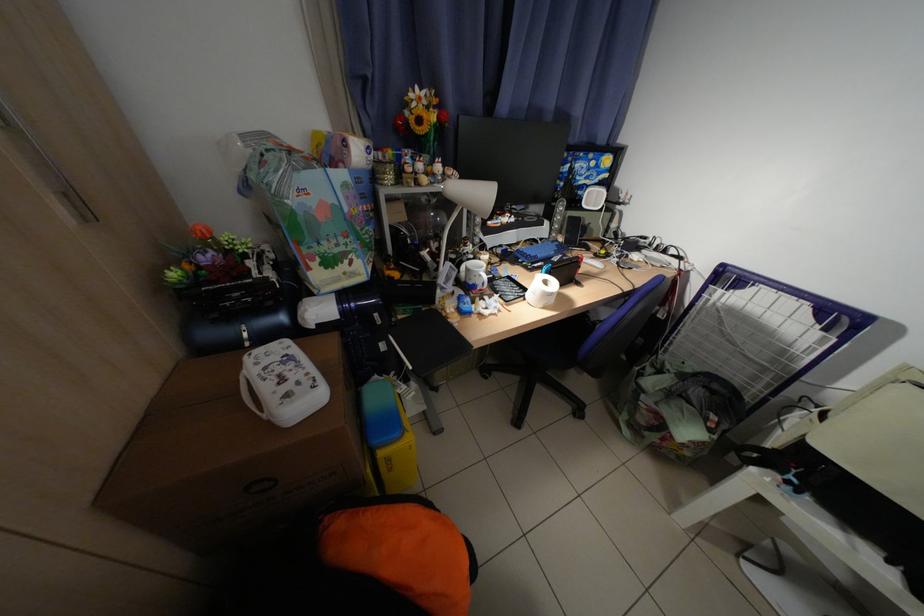
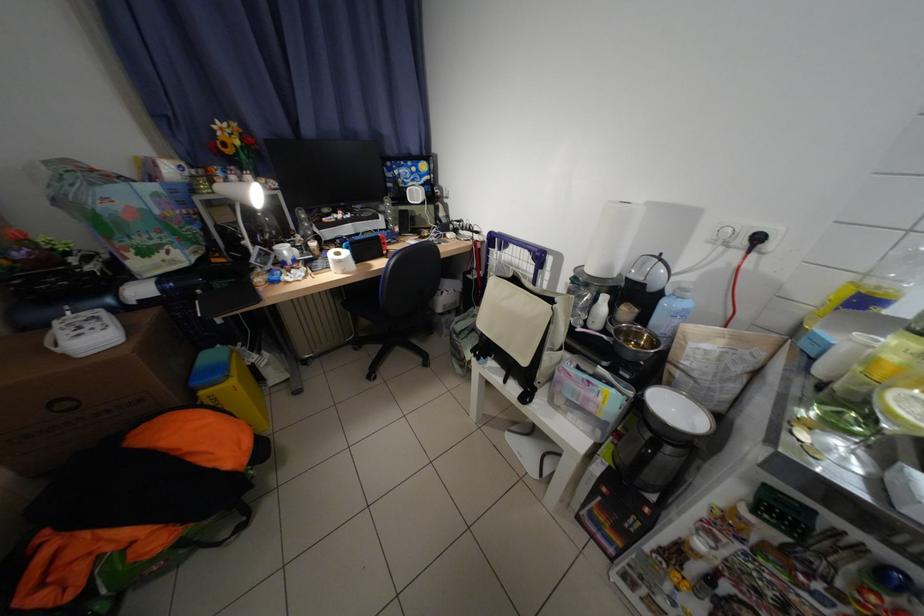
Question: How did the camera likely rotate?

Choices:
 (A) Left
 (B) Right
 (C) Up
 (D) Down

Answer: (B)